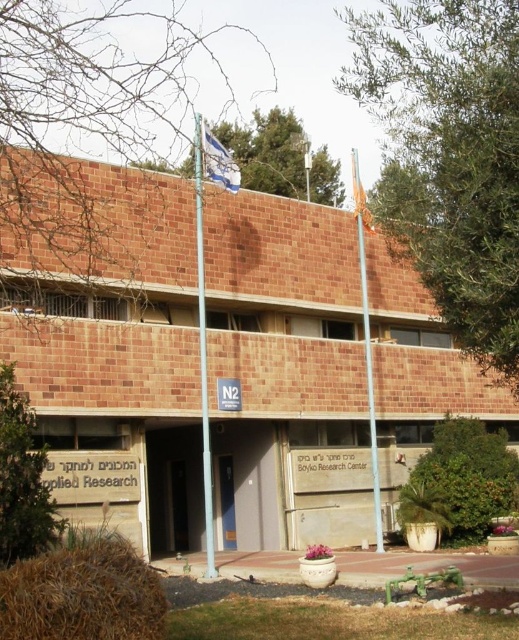
Is green metallic flag pole at center below blue fabric flag at upper center?

Correct, green metallic flag pole at center is located below blue fabric flag at upper center.

Is point (199, 275) closer to camera compared to point (213, 168)?

Yes, it is.

Is point (203, 344) closer to camera compared to point (204, 134)?

Yes, point (203, 344) is in front of point (204, 134).

You are a GUI agent. You are given a task and a screenshot of the screen. Output one action in this format:
    pyautogui.click(x=<x>, y=<y>)
    Task: Click on the green metallic flag pole at center
    The width and height of the screenshot is (519, 640).
    Given the screenshot: What is the action you would take?
    (x=203, y=342)

Which is more to the left, brown brick building at center or blue fabric flag at upper center?

From the viewer's perspective, blue fabric flag at upper center appears more on the left side.

Who is more distant from viewer, [216,426] or [213,180]?

The point [216,426] is more distant.

Where is `brown brick building at center`? This screenshot has width=519, height=640. brown brick building at center is located at coordinates (285, 372).

Is brown brick building at center positioned before green metallic flag pole at center?

No.

Does brown brick building at center have a lesser height compared to green metallic flag pole at center?

Yes.

Describe the element at coordinates (285, 372) in the screenshot. I see `brown brick building at center` at that location.

You are a GUI agent. You are given a task and a screenshot of the screen. Output one action in this format:
    pyautogui.click(x=<x>, y=<y>)
    Task: Click on the brown brick building at center
    This screenshot has width=519, height=640.
    Given the screenshot: What is the action you would take?
    pyautogui.click(x=285, y=372)